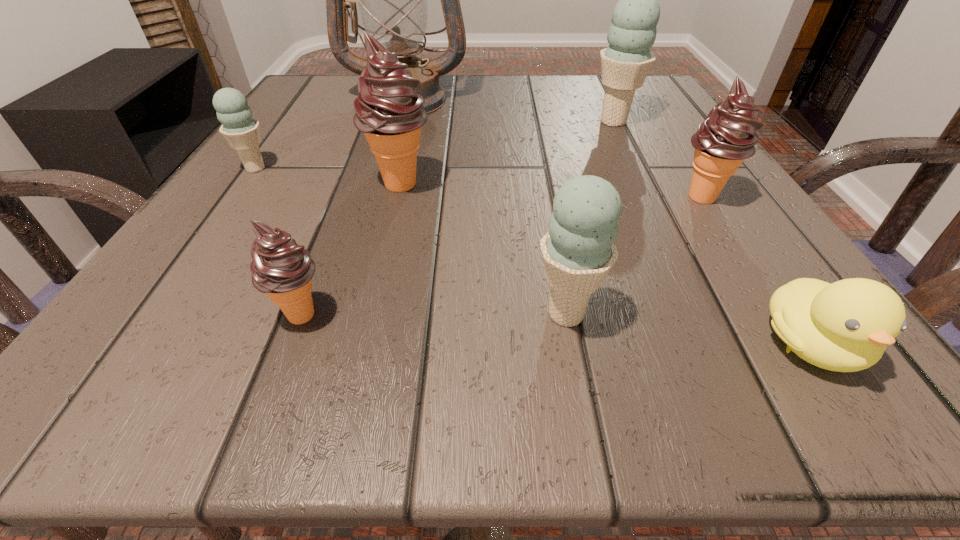
Locate an element on the screen. The width and height of the screenshot is (960, 540). icecream that is the fourth closest to the nearest chocolate icecream is located at coordinates (727, 137).

At what (x,y) coordinates should I click in order to perform the action: click on blue ice cream that is the nearest to the leftmost object. Please return your answer as a coordinate pair (x, y). Looking at the image, I should click on (578, 251).

The image size is (960, 540). Identify the location of blue ice cream that is the closest to the fourth icecream from left to right. (625, 63).

Select which chocolate icecream is the closest to the leftmost blue ice cream. Please provide its 2D coordinates. Your answer should be formatted as a tuple, i.e. [(x, y)], where the tuple contains the x and y coordinates of a point satisfying the conditions above.

[(390, 113)]

Image resolution: width=960 pixels, height=540 pixels. I want to click on the second closest chocolate icecream relative to the biggest chocolate icecream, so click(x=727, y=137).

I want to click on vacant space that satisfies the following two spatial constraints: 1. on the front side of the brown oil lamp; 2. on the left side of the biggest chocolate icecream, so click(379, 184).